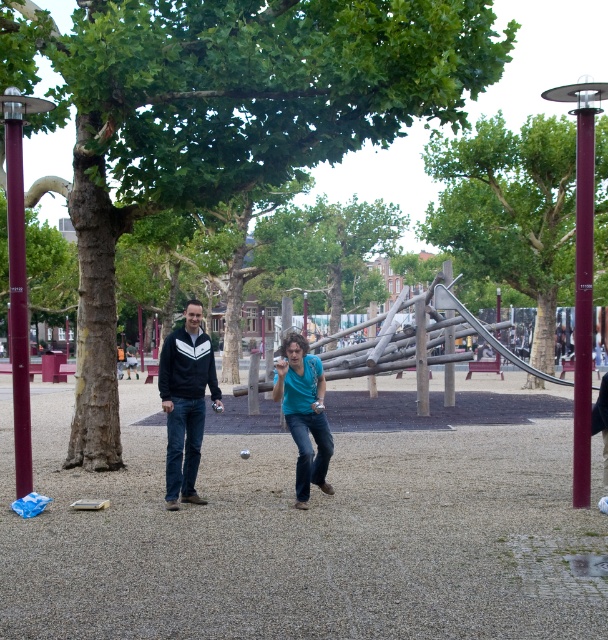
Question: Which point is farther from the camera taking this photo?

Choices:
 (A) pyautogui.click(x=126, y=356)
 (B) pyautogui.click(x=173, y=396)

Answer: (A)

Question: Which of the following is the closest to the observer?

Choices:
 (A) dark blue jacket at center
 (B) blue denim jeans at center
 (C) matte black jacket at center

Answer: (A)

Question: Which object is positioned closest to the dark blue jacket at center?

Choices:
 (A) matte black jacket at center
 (B) blue denim jeans at center

Answer: (B)

Question: Can you confirm if blue denim jeans at center is bigger than matte black jacket at center?

Choices:
 (A) yes
 (B) no

Answer: (B)

Question: Can you confirm if dark blue jacket at center is positioned above matte black jacket at center?

Choices:
 (A) no
 (B) yes

Answer: (B)

Question: Is blue denim jeans at center to the right of matte black jacket at center from the viewer's perspective?

Choices:
 (A) no
 (B) yes

Answer: (B)